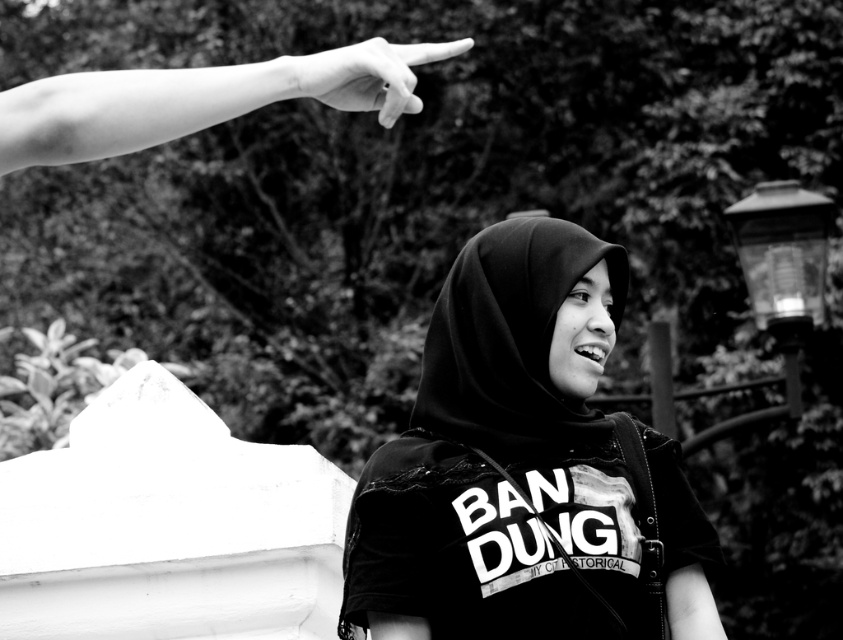
Question: Which object is closer to the camera taking this photo?

Choices:
 (A) smooth skin finger at upper left
 (B) black matte hijab at center
 (C) smooth skin hand at upper left

Answer: (C)

Question: Which object is farther from the camera taking this photo?

Choices:
 (A) smooth skin hand at upper left
 (B) black matte hijab at center

Answer: (B)

Question: Estimate the real-world distances between objects in this image. Which object is closer to the smooth skin hand at upper left?

Choices:
 (A) black matte hijab at center
 (B) smooth skin finger at upper left

Answer: (B)

Question: Does smooth skin hand at upper left have a greater width compared to smooth skin finger at upper left?

Choices:
 (A) yes
 (B) no

Answer: (A)

Question: Does black matte hijab at center lie behind smooth skin hand at upper left?

Choices:
 (A) no
 (B) yes

Answer: (B)

Question: Is the position of smooth skin hand at upper left more distant than that of smooth skin finger at upper left?

Choices:
 (A) yes
 (B) no

Answer: (B)